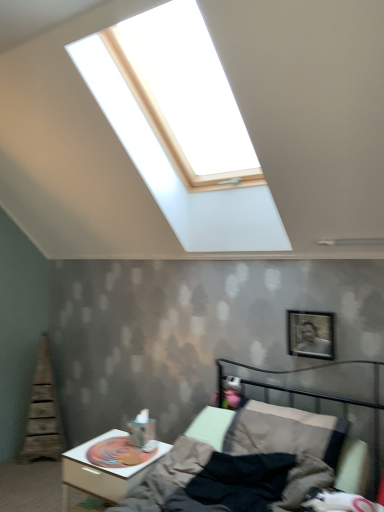
Question: Would you say white glossy nightstand at lower left is a long distance from metallic gray bed at lower right?

Choices:
 (A) no
 (B) yes

Answer: (A)

Question: Considering the relative sizes of white glossy nightstand at lower left and metallic gray bed at lower right in the image provided, is white glossy nightstand at lower left taller than metallic gray bed at lower right?

Choices:
 (A) yes
 (B) no

Answer: (B)

Question: Is the depth of white glossy nightstand at lower left less than that of metallic gray bed at lower right?

Choices:
 (A) no
 (B) yes

Answer: (A)

Question: From a real-world perspective, is white glossy nightstand at lower left located beneath metallic gray bed at lower right?

Choices:
 (A) no
 (B) yes

Answer: (B)

Question: From a real-world perspective, is white glossy nightstand at lower left over metallic gray bed at lower right?

Choices:
 (A) no
 (B) yes

Answer: (A)

Question: Does white glossy nightstand at lower left have a lesser height compared to metallic gray bed at lower right?

Choices:
 (A) yes
 (B) no

Answer: (A)

Question: Is metallic gray bed at lower right surrounding metallic silver picture frame at upper right?

Choices:
 (A) no
 (B) yes

Answer: (A)

Question: Is metallic gray bed at lower right positioned with its back to metallic silver picture frame at upper right?

Choices:
 (A) no
 (B) yes

Answer: (A)

Question: Considering the relative sizes of metallic gray bed at lower right and metallic silver picture frame at upper right in the image provided, is metallic gray bed at lower right bigger than metallic silver picture frame at upper right?

Choices:
 (A) yes
 (B) no

Answer: (A)

Question: Does metallic gray bed at lower right appear on the left side of metallic silver picture frame at upper right?

Choices:
 (A) no
 (B) yes

Answer: (B)

Question: Does metallic gray bed at lower right appear on the right side of metallic silver picture frame at upper right?

Choices:
 (A) no
 (B) yes

Answer: (A)

Question: Could you tell me if metallic gray bed at lower right is facing metallic silver picture frame at upper right?

Choices:
 (A) no
 (B) yes

Answer: (A)

Question: Is white glossy nightstand at lower left surrounded by metallic silver picture frame at upper right?

Choices:
 (A) yes
 (B) no

Answer: (B)